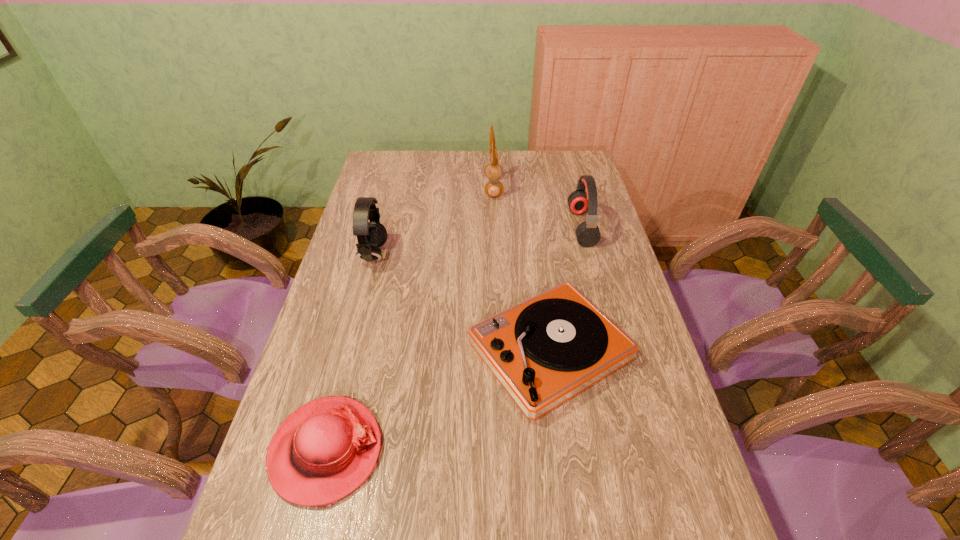
I want to click on the farthest earphone, so click(494, 188).

I want to click on the farthest object, so pos(494,188).

Locate an element on the screen. The image size is (960, 540). the leftmost earphone is located at coordinates (371, 235).

Where is `the rightmost earphone`? the rightmost earphone is located at coordinates (588, 234).

Where is `hat`? Image resolution: width=960 pixels, height=540 pixels. hat is located at coordinates (323, 451).

You are a GUI agent. You are given a task and a screenshot of the screen. Output one action in this format:
    pyautogui.click(x=<x>, y=<y>)
    Task: Click on the record player
    This screenshot has height=540, width=960.
    Given the screenshot: What is the action you would take?
    pyautogui.click(x=545, y=350)

Locate an element on the screen. The width and height of the screenshot is (960, 540). free location located 0.060m on the front-facing side of the farthest object is located at coordinates (469, 188).

What are the coordinates of `blank space located 0.170m on the front-facing side of the farthest object` in the screenshot? It's located at (442, 188).

At what (x,y) coordinates should I click in order to perform the action: click on free region located 0.080m on the front-facing side of the farthest object. Please return your answer as a coordinate pair (x, y). Image resolution: width=960 pixels, height=540 pixels. Looking at the image, I should click on 465,188.

Find the location of a particular element. The height and width of the screenshot is (540, 960). vacant area located 0.080m on the ear cups of the leftmost earphone is located at coordinates (411, 255).